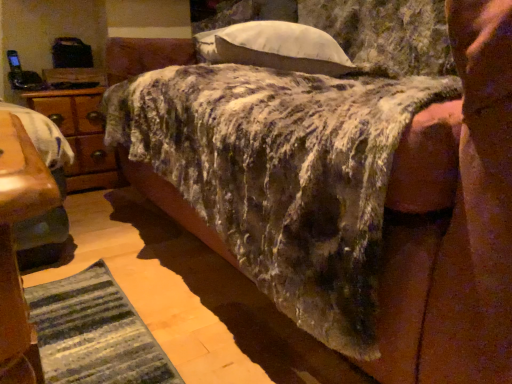
Question: Is white soft pillow at upper center a part of wooden nightstand at left?

Choices:
 (A) no
 (B) yes

Answer: (A)

Question: Would you say wooden nightstand at left is a long distance from white soft pillow at upper center?

Choices:
 (A) no
 (B) yes

Answer: (A)

Question: From the image's perspective, is wooden nightstand at left under white soft pillow at upper center?

Choices:
 (A) no
 (B) yes

Answer: (B)

Question: Is wooden nightstand at left facing towards white soft pillow at upper center?

Choices:
 (A) yes
 (B) no

Answer: (A)

Question: Considering the relative sizes of wooden nightstand at left and white soft pillow at upper center in the image provided, is wooden nightstand at left shorter than white soft pillow at upper center?

Choices:
 (A) no
 (B) yes

Answer: (A)

Question: In terms of width, does wooden nightstand at left look wider or thinner when compared to fuzzy fabric mattress at center?

Choices:
 (A) wide
 (B) thin

Answer: (B)

Question: From their relative heights in the image, would you say wooden nightstand at left is taller or shorter than fuzzy fabric mattress at center?

Choices:
 (A) tall
 (B) short

Answer: (B)

Question: In the image, is wooden nightstand at left positioned in front of or behind fuzzy fabric mattress at center?

Choices:
 (A) behind
 (B) front

Answer: (A)

Question: Is wooden nightstand at left to the left or to the right of fuzzy fabric mattress at center in the image?

Choices:
 (A) right
 (B) left

Answer: (B)

Question: From the image's perspective, is wooden nightstand at left located above or below white soft pillow at upper center?

Choices:
 (A) below
 (B) above

Answer: (A)

Question: Is wooden nightstand at left in front of or behind white soft pillow at upper center in the image?

Choices:
 (A) behind
 (B) front

Answer: (A)

Question: Considering the positions of wooden nightstand at left and white soft pillow at upper center in the image, is wooden nightstand at left taller or shorter than white soft pillow at upper center?

Choices:
 (A) tall
 (B) short

Answer: (A)

Question: Is point coord(84,147) positioned closer to the camera than point coord(224,61)?

Choices:
 (A) closer
 (B) farther

Answer: (B)

Question: From a real-world perspective, is fuzzy fabric mattress at center above or below white soft pillow at upper center?

Choices:
 (A) below
 (B) above

Answer: (A)

Question: From the image's perspective, is fuzzy fabric mattress at center positioned above or below white soft pillow at upper center?

Choices:
 (A) above
 (B) below

Answer: (B)